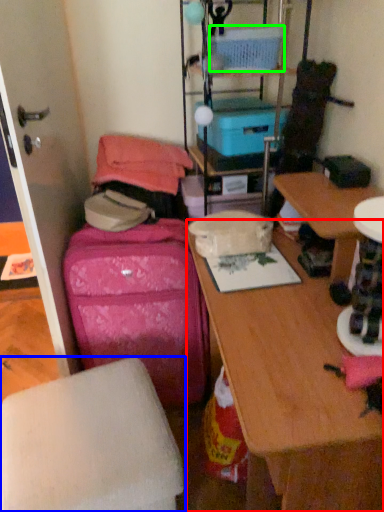
Question: Estimate the real-world distances between objects in this image. Which object is farther from desk (highlighted by a red box), furniture (highlighted by a blue box) or storage box (highlighted by a green box)?

Choices:
 (A) furniture
 (B) storage box

Answer: (B)